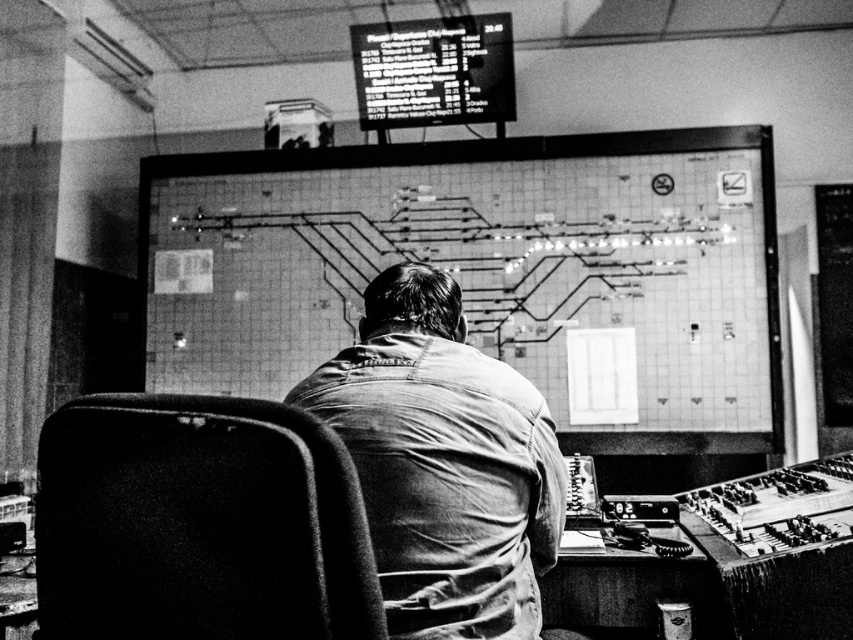
Is point (164, 625) more distant than point (469, 461)?

No, (164, 625) is in front of (469, 461).

At what (x,y) coordinates should I click in order to perform the action: click on velvety black chair at center. Please return your answer as a coordinate pair (x, y). Looking at the image, I should click on (199, 524).

Does denim shirt at center appear over black plastic screen at upper center?

Actually, denim shirt at center is below black plastic screen at upper center.

Which is more to the left, denim shirt at center or black plastic screen at upper center?

black plastic screen at upper center

Locate an element on the screen. Image resolution: width=853 pixels, height=640 pixels. denim shirt at center is located at coordinates (444, 461).

Where is `denim shirt at center`? The image size is (853, 640). denim shirt at center is located at coordinates (444, 461).

What do you see at coordinates (199, 524) in the screenshot? The image size is (853, 640). I see `velvety black chair at center` at bounding box center [199, 524].

Is point (120, 492) positioned after point (376, 92)?

No, it is not.

Does point (254, 438) come behind point (430, 49)?

No.

Identify the location of velvety black chair at center. (199, 524).